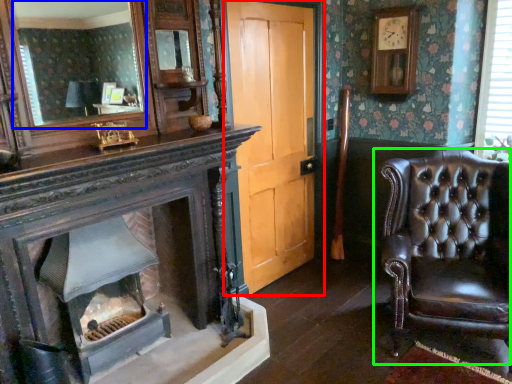
Question: Based on their relative distances, which object is nearer to door (highlighted by a red box)? Choose from mirror (highlighted by a blue box) and chair (highlighted by a green box).

Choices:
 (A) mirror
 (B) chair

Answer: (B)